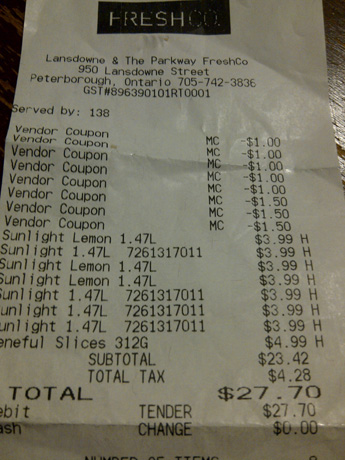
Where is `reflection on table`? reflection on table is located at coordinates (340, 105).